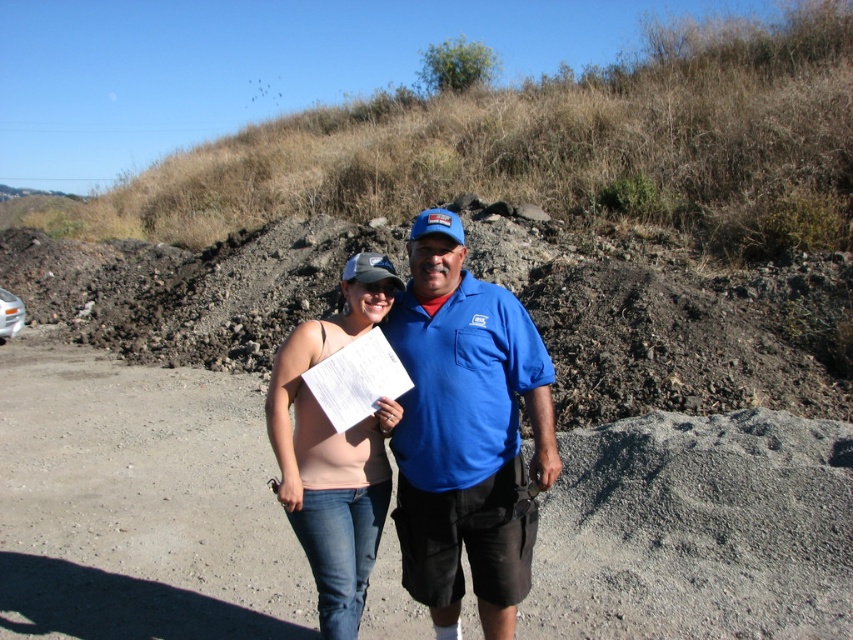
From the picture: Does dirt track at center lie in front of matte pink tank top at center?

That is False.

Who is more forward, (244,536) or (389,300)?

Positioned in front is point (389,300).

This screenshot has height=640, width=853. What do you see at coordinates (138, 504) in the screenshot? I see `dirt track at center` at bounding box center [138, 504].

At what (x,y) coordinates should I click in order to perform the action: click on dirt track at center. Please return your answer as a coordinate pair (x, y). Looking at the image, I should click on (138, 504).

Can you confirm if dirt track at center is bigger than blue cotton shirt at center?

Correct, dirt track at center is larger in size than blue cotton shirt at center.

The image size is (853, 640). I want to click on dirt track at center, so click(x=138, y=504).

Locate an element on the screen. The image size is (853, 640). blue cotton shirt at center is located at coordinates (466, 433).

Is point (508, 614) closer to camera compared to point (387, 404)?

That is False.

Find the location of a particular element. Image resolution: width=853 pixels, height=640 pixels. blue cotton shirt at center is located at coordinates (466, 433).